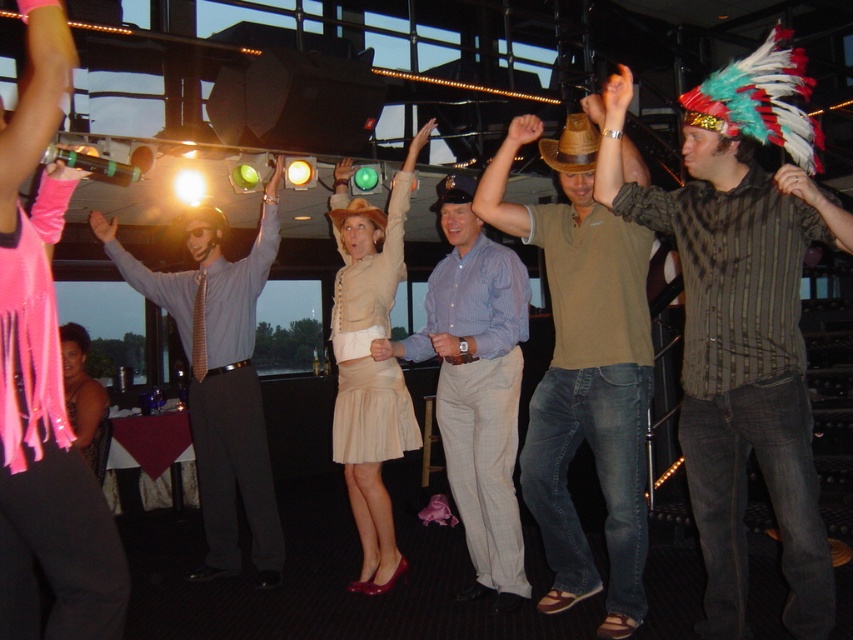
Question: Which point is closer to the camera taking this photo?

Choices:
 (A) (511, 154)
 (B) (825, 214)
 (C) (442, 355)

Answer: (B)

Question: Which object is farther from the camera taking this photo?

Choices:
 (A) matte brown wristwatch at center
 (B) matte white shirt at upper center
 (C) matte gray shirt at upper center

Answer: (C)

Question: Does matte brown hat at center appear on the left side of striped fabric shirt at upper right?

Choices:
 (A) no
 (B) yes

Answer: (B)

Question: Does pink satin arm band at upper left come behind matte beige skirt at center?

Choices:
 (A) yes
 (B) no

Answer: (B)

Question: Which point appears farthest from the camera in this image?

Choices:
 (A) (526, 116)
 (B) (496, 212)
 (C) (421, 131)
 (D) (96, 234)

Answer: (D)

Question: Where is matte brown hat at center located in relation to brown leather hand at upper center in the image?

Choices:
 (A) above
 (B) below

Answer: (B)